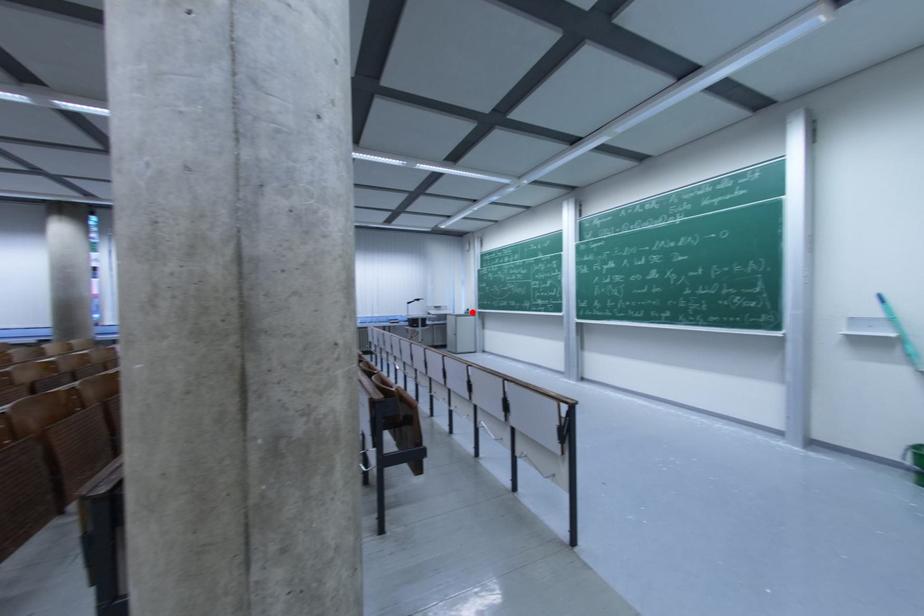
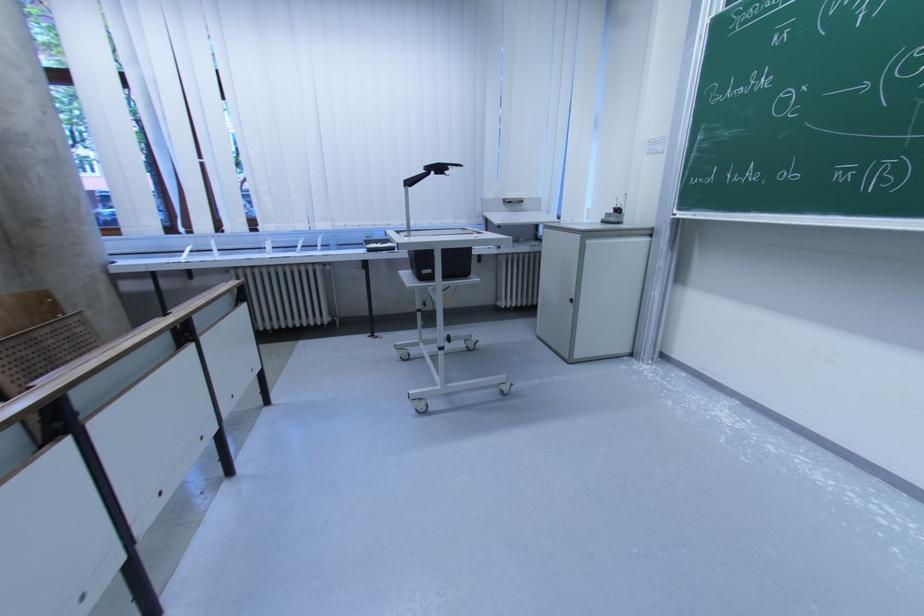
In the second image, find the point that corresponds to the highlighted location in the first image.

(622, 213)